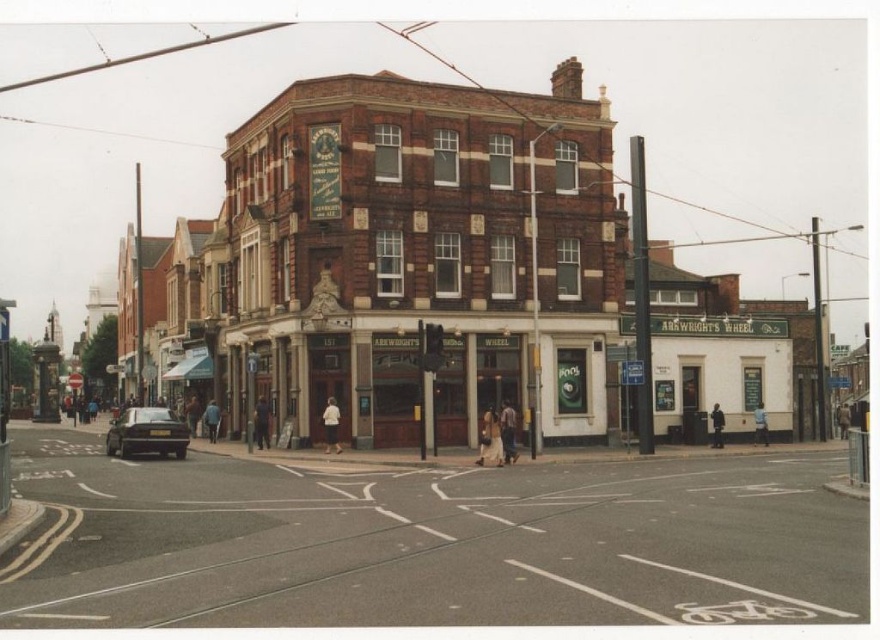
Question: Is light brown leather jacket at center in front of dark brown leather jacket at lower center?

Choices:
 (A) yes
 (B) no

Answer: (A)

Question: From the image, what is the correct spatial relationship of light brown fabric dress at center in relation to dark blue jeans at center?

Choices:
 (A) right
 (B) left

Answer: (A)

Question: Which is nearer to the dark brown leather jacket at center?

Choices:
 (A) blue fabric jacket at center
 (B) dark blue jeans at center
 (C) smooth asphalt road at center

Answer: (B)

Question: Estimate the real-world distances between objects in this image. Which object is closer to the smooth asphalt road at center?

Choices:
 (A) brown leather jacket at center
 (B) dark brown leather jacket at lower center
 (C) dark brown leather jacket at center
 (D) dark blue jacket at lower right

Answer: (C)

Question: From the image, what is the correct spatial relationship of light brown leather jacket at center in relation to blue fabric jacket at center?

Choices:
 (A) below
 (B) above

Answer: (A)

Question: Which object appears closest to the camera in this image?

Choices:
 (A) dark brown leather jacket at center
 (B) smooth asphalt road at center
 (C) dark blue jeans at center

Answer: (B)